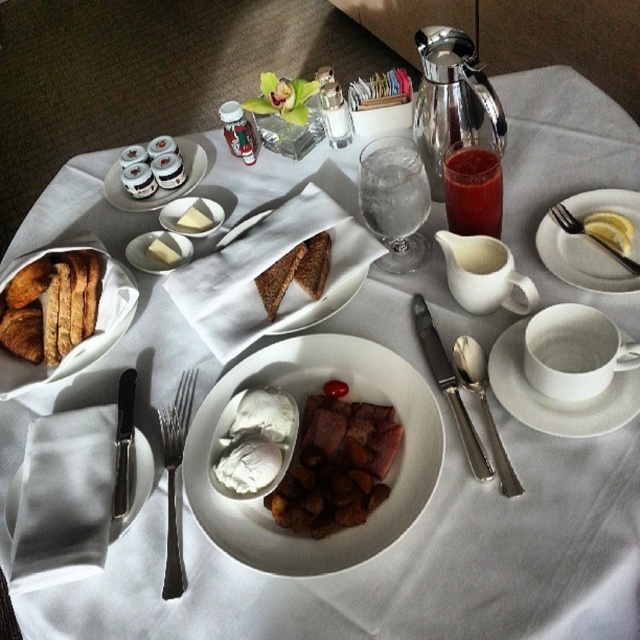
Question: Which point appears closest to the camera in this image?

Choices:
 (A) (10, 326)
 (B) (253, 250)

Answer: (B)

Question: Can you confirm if brown crumbly bread at center is thinner than silvermetallicknife at center-left?

Choices:
 (A) yes
 (B) no

Answer: (A)

Question: Which object appears farthest from the camera in this image?

Choices:
 (A) satin silver spoon at lower center
 (B) white creamy butter at center

Answer: (B)

Question: Is silvermetallicfork at left bigger than white matte butter at center?

Choices:
 (A) no
 (B) yes

Answer: (B)

Question: Which object is farther from the camera taking this photo?

Choices:
 (A) white porcelain plate at center
 (B) white ceramic plate at upper left
 (C) yellow lemon slice at upper right
 (D) satin silver spoon at lower center

Answer: (B)

Question: Is white ceramic cup at right to the left of smooth red liquid at upper right from the viewer's perspective?

Choices:
 (A) no
 (B) yes

Answer: (A)